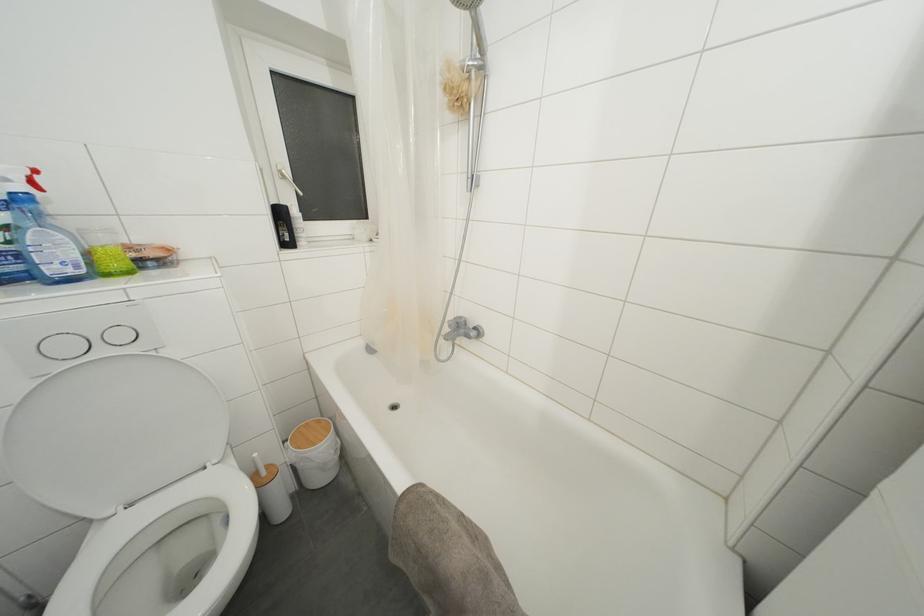
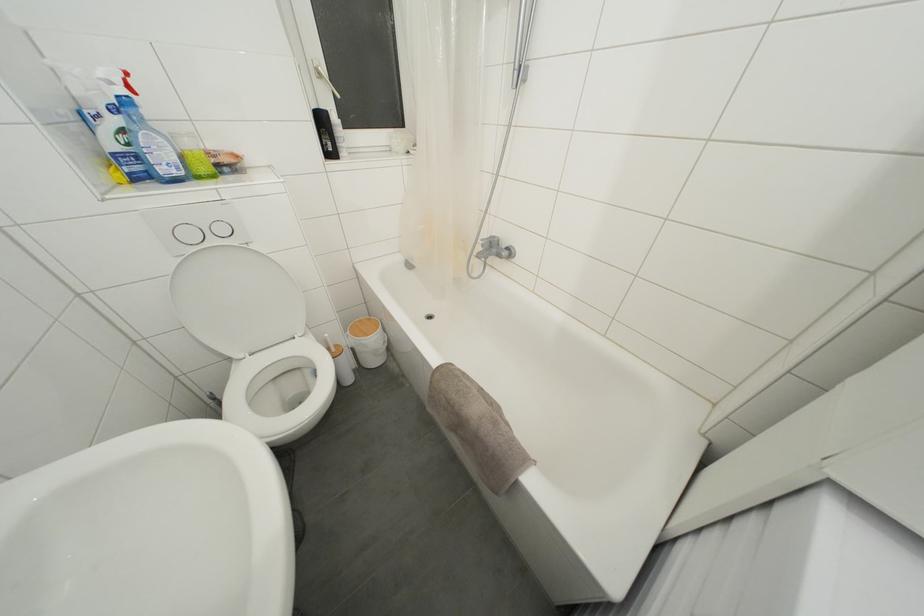
In the second image, find the point that corresponds to point (260, 459) in the first image.

(331, 339)